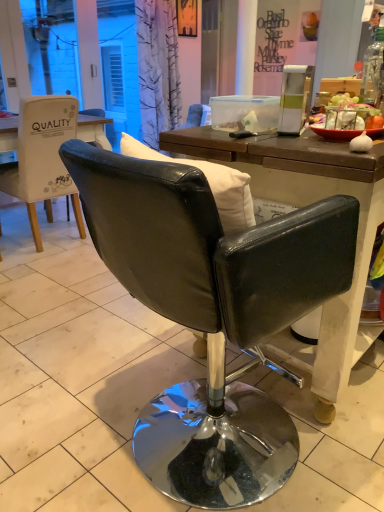
Question: Is the surface of transparent glass bottle at upper right in direct contact with black leather chair at center, arranged as the 1th chair when viewed from the right?

Choices:
 (A) yes
 (B) no

Answer: (B)

Question: Is transparent glass bottle at upper right further to camera compared to black leather chair at center, marked as the second chair in a left-to-right arrangement?

Choices:
 (A) no
 (B) yes

Answer: (B)

Question: Does transparent glass bottle at upper right have a smaller size compared to black leather chair at center, marked as the second chair in a left-to-right arrangement?

Choices:
 (A) yes
 (B) no

Answer: (A)

Question: Considering the relative sizes of transparent glass bottle at upper right and black leather chair at center, which is the second chair in back-to-front order, in the image provided, is transparent glass bottle at upper right taller than black leather chair at center, which is the second chair in back-to-front order,?

Choices:
 (A) no
 (B) yes

Answer: (A)

Question: Can you confirm if transparent glass bottle at upper right is wider than black leather chair at center, arranged as the 1th chair when viewed from the right?

Choices:
 (A) no
 (B) yes

Answer: (A)

Question: Does transparent glass bottle at upper right turn towards black leather chair at center, marked as the second chair in a left-to-right arrangement?

Choices:
 (A) no
 (B) yes

Answer: (A)

Question: Is black leather chair at center, arranged as the 1th chair when viewed from the right, outside matte black sign at upper center?

Choices:
 (A) yes
 (B) no

Answer: (A)

Question: Is black leather chair at center, marked as the second chair in a left-to-right arrangement, positioned with its back to matte black sign at upper center?

Choices:
 (A) yes
 (B) no

Answer: (B)

Question: From the image's perspective, is black leather chair at center, arranged as the 1th chair when viewed from the right, located above matte black sign at upper center?

Choices:
 (A) no
 (B) yes

Answer: (A)

Question: From the image's perspective, is black leather chair at center, marked as the second chair in a left-to-right arrangement, located beneath matte black sign at upper center?

Choices:
 (A) no
 (B) yes

Answer: (B)

Question: Can you confirm if black leather chair at center, which is the second chair in back-to-front order, is thinner than matte black sign at upper center?

Choices:
 (A) yes
 (B) no

Answer: (B)

Question: Is black leather chair at center, which is the 1th chair from front to back, behind matte black sign at upper center?

Choices:
 (A) no
 (B) yes

Answer: (A)

Question: Does black leather chair at center, marked as the second chair in a left-to-right arrangement, lie behind transparent glass bottle at upper right?

Choices:
 (A) yes
 (B) no

Answer: (B)